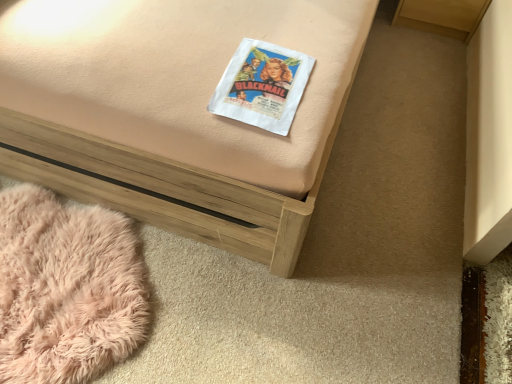
Question: Is matte paper book at center closer to the viewer compared to wooden bed frame at center?

Choices:
 (A) yes
 (B) no

Answer: (B)

Question: Is matte paper book at center with wooden bed frame at center?

Choices:
 (A) yes
 (B) no

Answer: (B)

Question: Is matte paper book at center outside of wooden bed frame at center?

Choices:
 (A) no
 (B) yes

Answer: (A)

Question: Does matte paper book at center have a smaller size compared to wooden bed frame at center?

Choices:
 (A) no
 (B) yes

Answer: (B)

Question: Considering the relative sizes of matte paper book at center and wooden bed frame at center in the image provided, is matte paper book at center shorter than wooden bed frame at center?

Choices:
 (A) no
 (B) yes

Answer: (B)

Question: Is matte paper book at center facing away from wooden bed frame at center?

Choices:
 (A) no
 (B) yes

Answer: (B)

Question: Is wooden bed frame at center at the left side of matte paper book at center?

Choices:
 (A) no
 (B) yes

Answer: (B)

Question: From a real-world perspective, is wooden bed frame at center on matte paper book at center?

Choices:
 (A) no
 (B) yes

Answer: (A)

Question: Is matte paper book at center at the back of wooden bed frame at center?

Choices:
 (A) yes
 (B) no

Answer: (B)

Question: Is wooden bed frame at center in contact with matte paper book at center?

Choices:
 (A) no
 (B) yes

Answer: (A)

Question: Is wooden bed frame at center surrounding matte paper book at center?

Choices:
 (A) yes
 (B) no

Answer: (A)

Question: From the image's perspective, is wooden bed frame at center located above matte paper book at center?

Choices:
 (A) no
 (B) yes

Answer: (B)

Question: Would you say matte paper book at center is part of fluffy pink rug at lower left's contents?

Choices:
 (A) yes
 (B) no

Answer: (B)